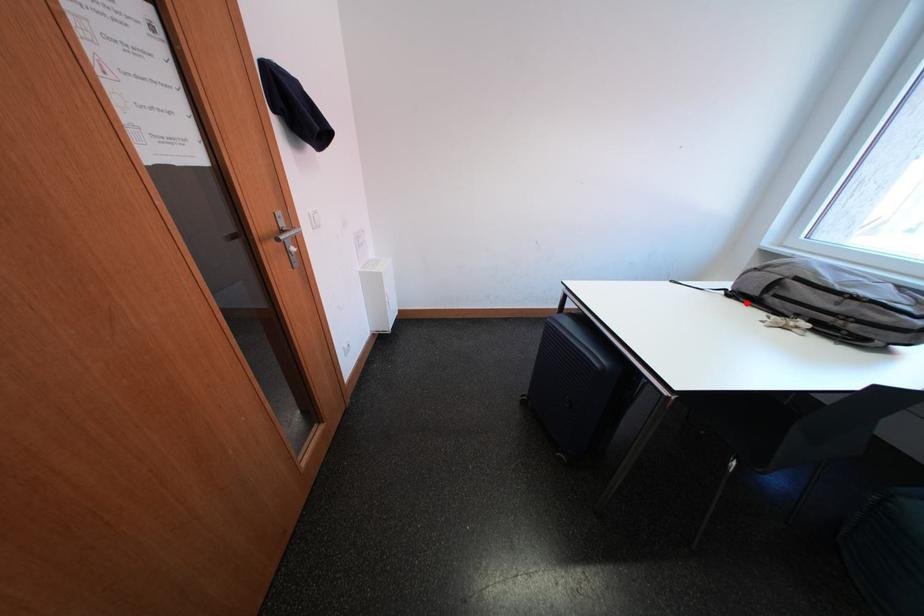
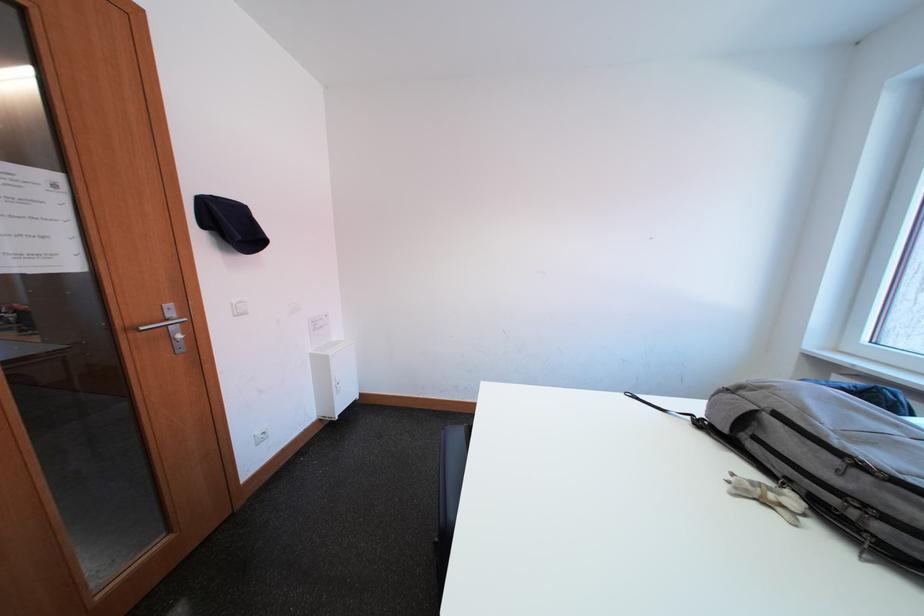
Find the pixel in the second image that matches the highlighted location in the first image.

(719, 438)